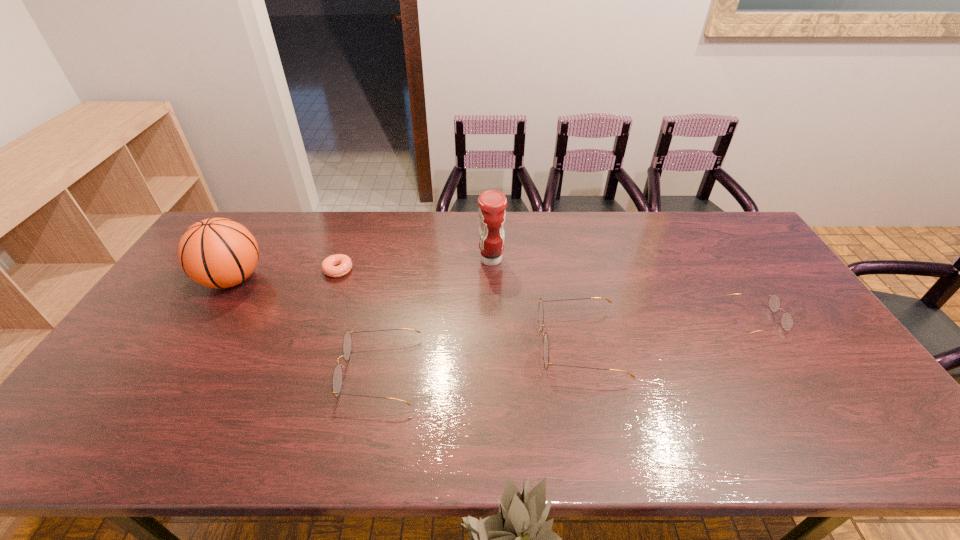
I want to click on free space located on the temples of the fourth object from right to left, so click(209, 372).

Identify the location of vacant space located 0.330m on the temples of the fourth object from right to left. The image size is (960, 540). (213, 372).

Where is `vacant space situated 0.400m on the temples of the fifth object from left to right`? The height and width of the screenshot is (540, 960). vacant space situated 0.400m on the temples of the fifth object from left to right is located at coordinates (391, 344).

Identify the location of vacant region located 0.090m on the temples of the fifth object from left to right. (504, 344).

I want to click on vacant region located on the temples of the fifth object from left to right, so click(475, 344).

Locate an element on the screen. free space located 0.060m on the temples of the second shortest object is located at coordinates (800, 319).

Locate an element on the screen. This screenshot has height=540, width=960. vacant space located 0.060m on the right of the shortest object is located at coordinates [372, 270].

The image size is (960, 540). In order to click on vacant point located on the right of the fourth object from left to right in this screenshot , I will do `click(586, 260)`.

The height and width of the screenshot is (540, 960). What are the coordinates of `vacant space located on the right of the basketball` in the screenshot? It's located at (345, 279).

At what (x,y) coordinates should I click in order to perform the action: click on object that is at the far edge. Please return your answer as a coordinate pair (x, y). The image size is (960, 540). Looking at the image, I should click on (492, 203).